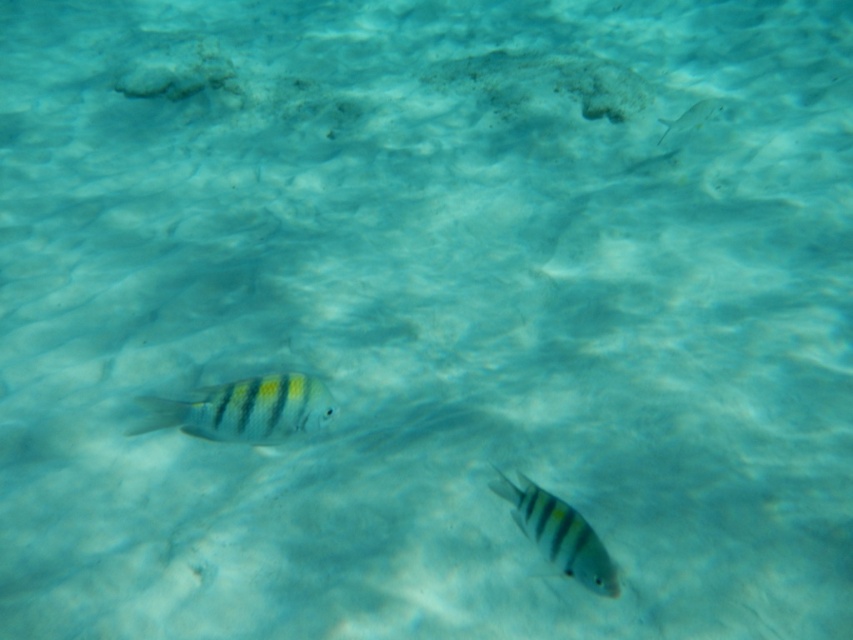
Who is lower down, yellow striped fish at center or translucent white fish at upper right?

yellow striped fish at center

Where is `yellow striped fish at center`? The height and width of the screenshot is (640, 853). yellow striped fish at center is located at coordinates (558, 534).

Locate an element on the screen. Image resolution: width=853 pixels, height=640 pixels. yellow striped fish at center is located at coordinates (558, 534).

Does yellow-green striped fish at lower left have a lesser width compared to translucent white fish at upper right?

In fact, yellow-green striped fish at lower left might be wider than translucent white fish at upper right.

Looking at this image, who is taller, yellow-green striped fish at lower left or translucent white fish at upper right?

translucent white fish at upper right is taller.

Describe the element at coordinates (242, 410) in the screenshot. Image resolution: width=853 pixels, height=640 pixels. I see `yellow-green striped fish at lower left` at that location.

The height and width of the screenshot is (640, 853). What are the coordinates of `yellow-green striped fish at lower left` in the screenshot? It's located at (242, 410).

From the picture: Can you confirm if yellow-green striped fish at lower left is bigger than yellow striped fish at center?

Incorrect, yellow-green striped fish at lower left is not larger than yellow striped fish at center.

Which of these two, yellow-green striped fish at lower left or yellow striped fish at center, stands shorter?

yellow-green striped fish at lower left

Does point (251, 401) come farther from viewer compared to point (515, 476)?

No.

This screenshot has width=853, height=640. I want to click on yellow-green striped fish at lower left, so pos(242,410).